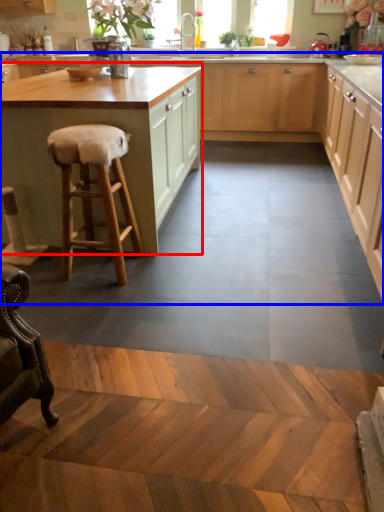
Question: Which object is closer to the camera taking this photo, cabinetry (highlighted by a red box) or cabinetry (highlighted by a blue box)?

Choices:
 (A) cabinetry
 (B) cabinetry

Answer: (B)